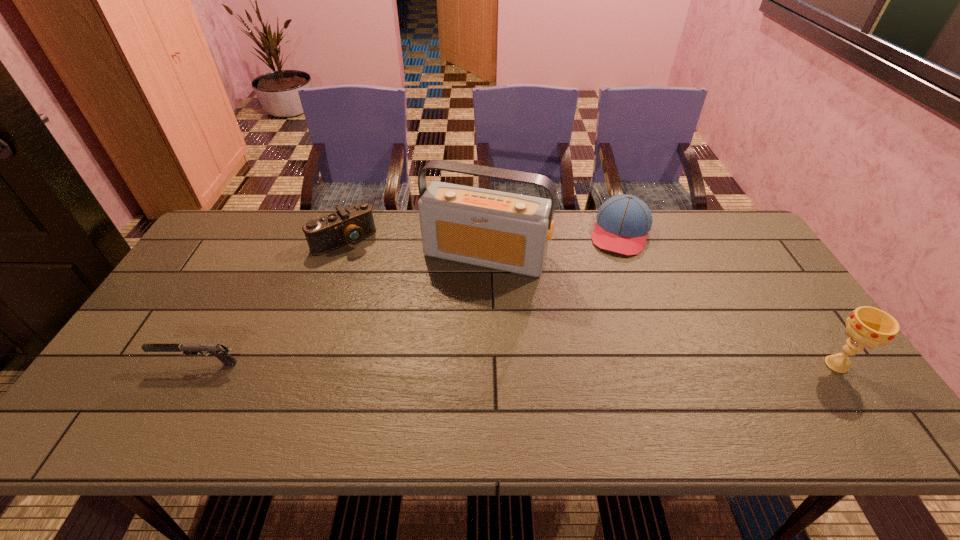
The image size is (960, 540). In the image, there is a desktop. What are the coordinates of `free region at the right edge` in the screenshot? It's located at pyautogui.click(x=734, y=278).

In the image, there is a desktop. Where is `vacant space at the far left corner`? The height and width of the screenshot is (540, 960). vacant space at the far left corner is located at coordinates (x=238, y=249).

Identify the location of free point at the far right corner. This screenshot has height=540, width=960. (713, 232).

Identify the location of vacant area between the baseball cap and the tallest object. (553, 244).

The image size is (960, 540). Identify the location of vacant region between the rightmost object and the fourth object from right to left. (590, 302).

Find the location of a particular element. This screenshot has height=540, width=960. empty space that is in between the leftmost object and the fourth shortest object is located at coordinates (517, 364).

Image resolution: width=960 pixels, height=540 pixels. I want to click on free space between the gun and the second tallest object, so click(517, 364).

The height and width of the screenshot is (540, 960). I want to click on free spot between the baseball cap and the rightmost object, so click(729, 299).

At what (x,y) coordinates should I click in order to perform the action: click on free space between the baseball cap and the tallest object. Please return your answer as a coordinate pair (x, y). This screenshot has height=540, width=960. Looking at the image, I should click on (553, 244).

In order to click on object that is the fourth closest to the third object from right to left in this screenshot , I will do `click(870, 327)`.